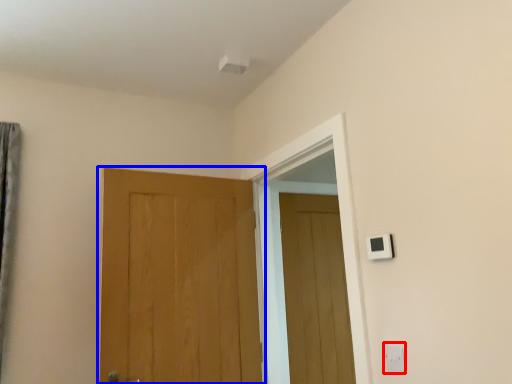
Question: Which object is further to the camera taking this photo, electric outlet (highlighted by a red box) or door (highlighted by a blue box)?

Choices:
 (A) electric outlet
 (B) door

Answer: (B)